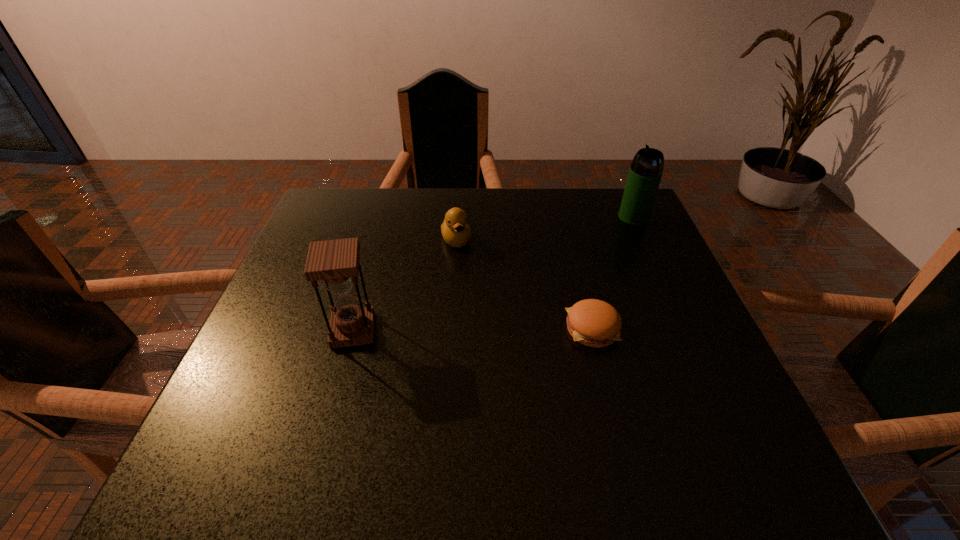
You are a GUI agent. You are given a task and a screenshot of the screen. Output one action in this format:
    pyautogui.click(x=<x>, y=<y>)
    Task: Click on the hourglass
    The height and width of the screenshot is (540, 960).
    Given the screenshot: What is the action you would take?
    pyautogui.click(x=336, y=262)

In order to click on the second object from right to left in this screenshot , I will do point(594,323).

At what (x,y) coordinates should I click in order to perform the action: click on patty. Please return your answer as a coordinate pair (x, y). Looking at the image, I should click on (594, 323).

This screenshot has height=540, width=960. Find the location of `the farthest object`. the farthest object is located at coordinates click(646, 169).

Where is `the rightmost object`? The width and height of the screenshot is (960, 540). the rightmost object is located at coordinates (646, 169).

I want to click on the second object from left to right, so click(455, 230).

This screenshot has width=960, height=540. What are the coordinates of `the third tallest object` in the screenshot? It's located at (455, 230).

The height and width of the screenshot is (540, 960). Find the location of `vacant region located 0.110m on the front of the leftmost object`. vacant region located 0.110m on the front of the leftmost object is located at coordinates (334, 397).

This screenshot has width=960, height=540. Find the location of `free space located on the left of the shortest object`. free space located on the left of the shortest object is located at coordinates (454, 329).

Find the location of `vacant position located from the spout of the farthest object`. vacant position located from the spout of the farthest object is located at coordinates (598, 245).